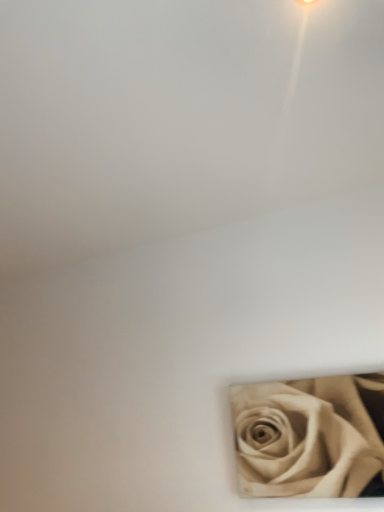
The image size is (384, 512). I want to click on beige textured rose at bottom right, so click(x=309, y=436).

What do you see at coordinates (309, 436) in the screenshot?
I see `beige textured rose at bottom right` at bounding box center [309, 436].

I want to click on beige textured rose at bottom right, so click(309, 436).